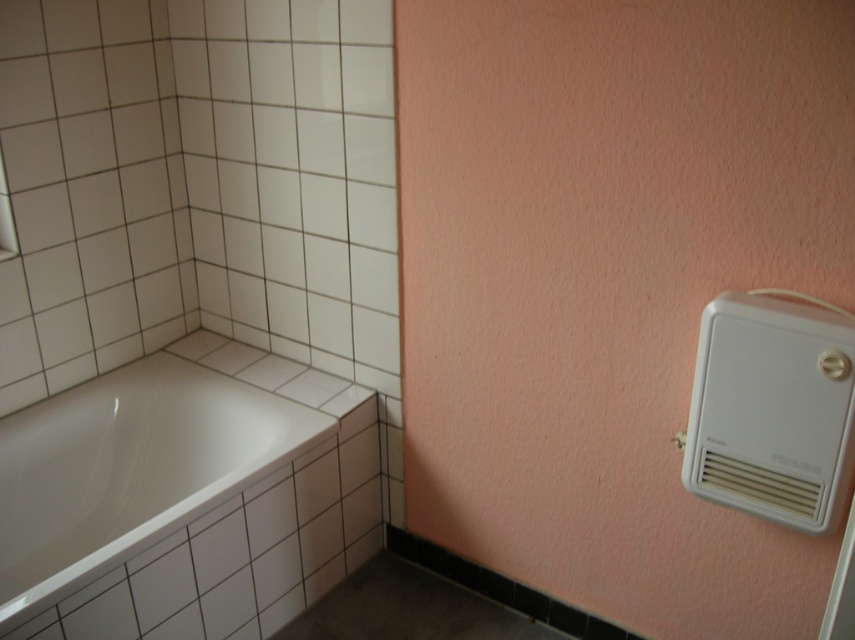
Identify the location of white glossy bathtub at lower left. This screenshot has height=640, width=855. (128, 468).

Which is behind, point (77, 433) or point (706, 468)?

The point (77, 433) is behind.

Does point (90, 484) lie behind point (832, 355)?

Yes, point (90, 484) is farther from viewer.

The image size is (855, 640). Identify the location of white glossy bathtub at lower left. (128, 468).